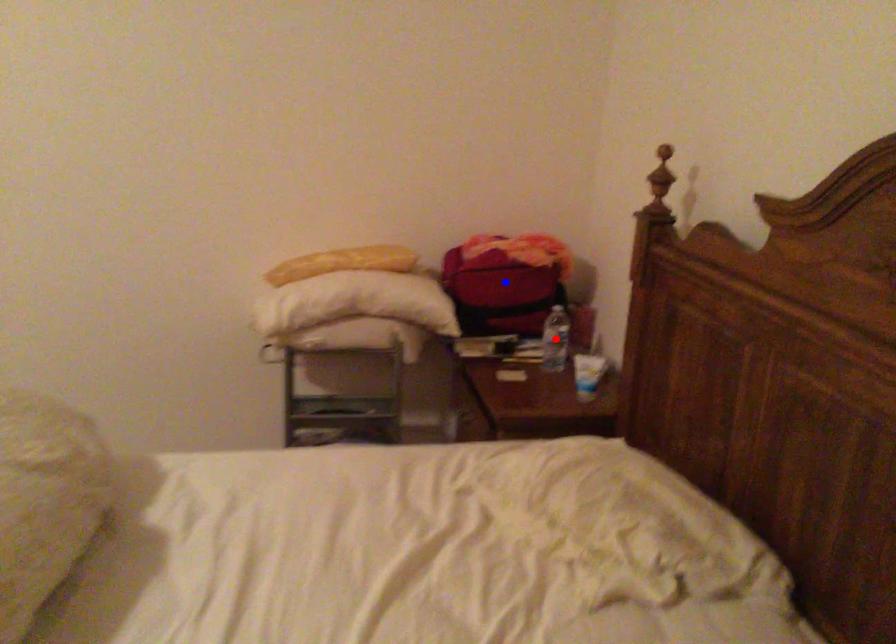
Question: Which of the two points in the image is closer to the camera?

Choices:
 (A) Blue point is closer.
 (B) Red point is closer.

Answer: (B)